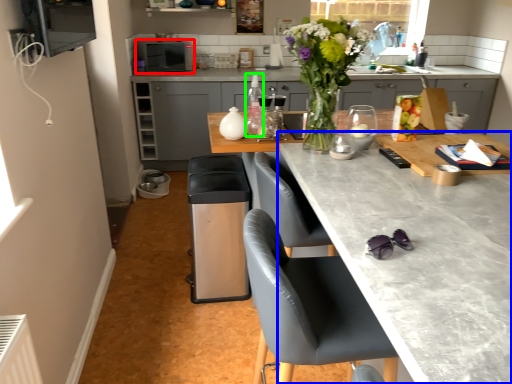
Question: Based on their relative distances, which object is farther from kitchen appliance (highlighted by a red box)? Choose from countertop (highlighted by a blue box) and bottle (highlighted by a green box).

Choices:
 (A) countertop
 (B) bottle

Answer: (A)